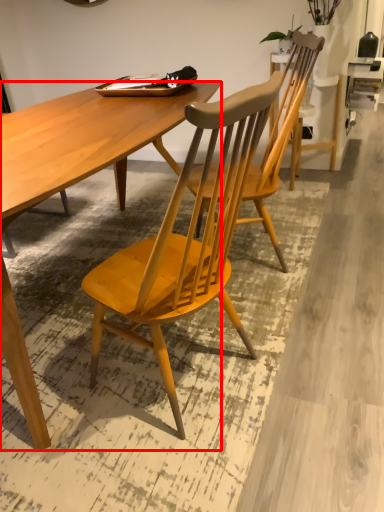
Question: Where is desk (annotated by the red box) located in relation to chair in the image?

Choices:
 (A) left
 (B) right

Answer: (A)